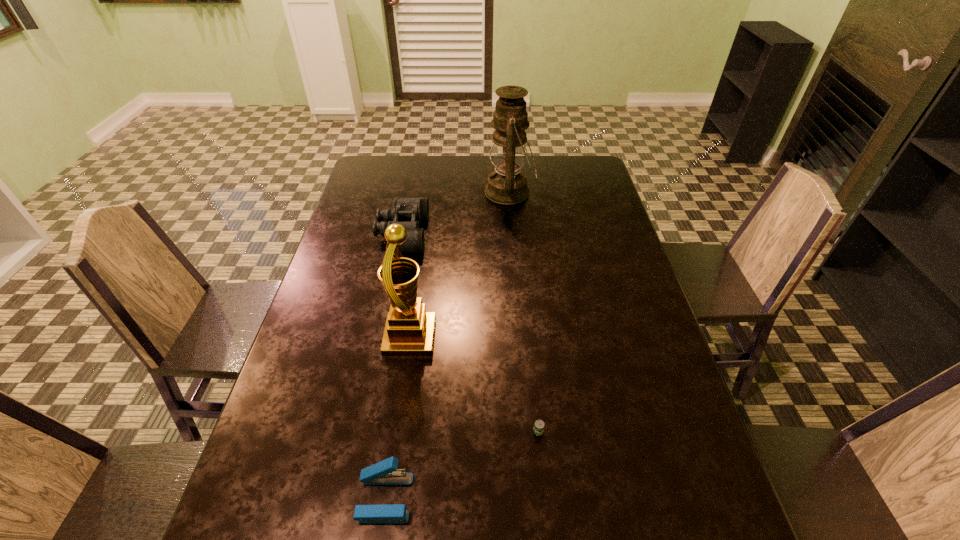
Locate an element on the screen. This screenshot has width=960, height=540. free point that satisfies the following two spatial constraints: 1. on the front-facing side of the third nearest object; 2. on the left side of the fourth farthest object is located at coordinates (396, 431).

Where is `vacant space that satisfies the following two spatial constraints: 1. on the back side of the fourth farthest object; 2. on the left side of the second shortest object`? The image size is (960, 540). vacant space that satisfies the following two spatial constraints: 1. on the back side of the fourth farthest object; 2. on the left side of the second shortest object is located at coordinates (395, 431).

The image size is (960, 540). Identify the location of free point that satisfies the following two spatial constraints: 1. at the eyepieces of the third shortest object; 2. on the right side of the stapler. (348, 498).

I want to click on free region that satisfies the following two spatial constraints: 1. on the front-facing side of the third nearest object; 2. on the front side of the stapler, so click(387, 498).

Locate an element on the screen. The height and width of the screenshot is (540, 960). free space in the image that satisfies the following two spatial constraints: 1. on the front side of the oil lamp; 2. at the eyepieces of the binoculars is located at coordinates click(x=513, y=233).